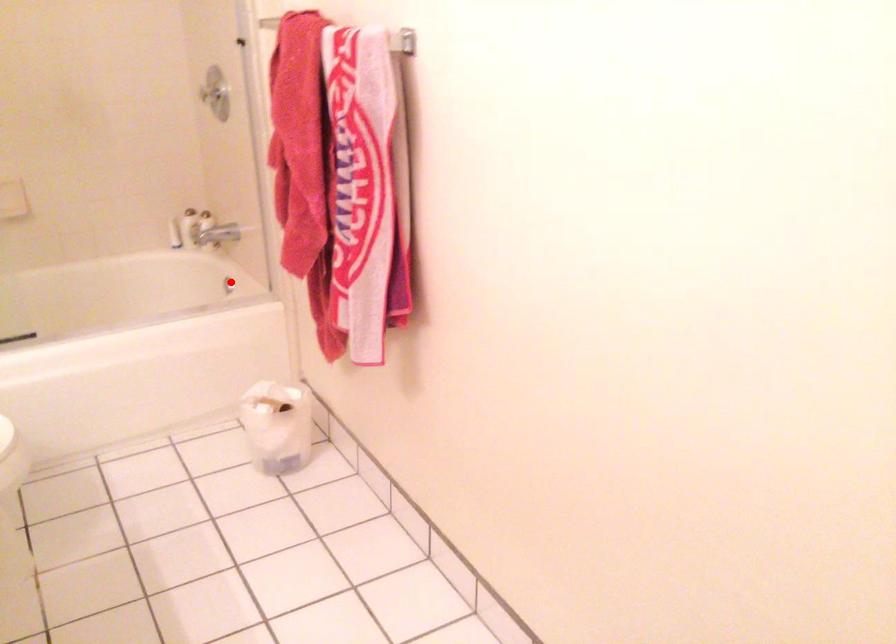
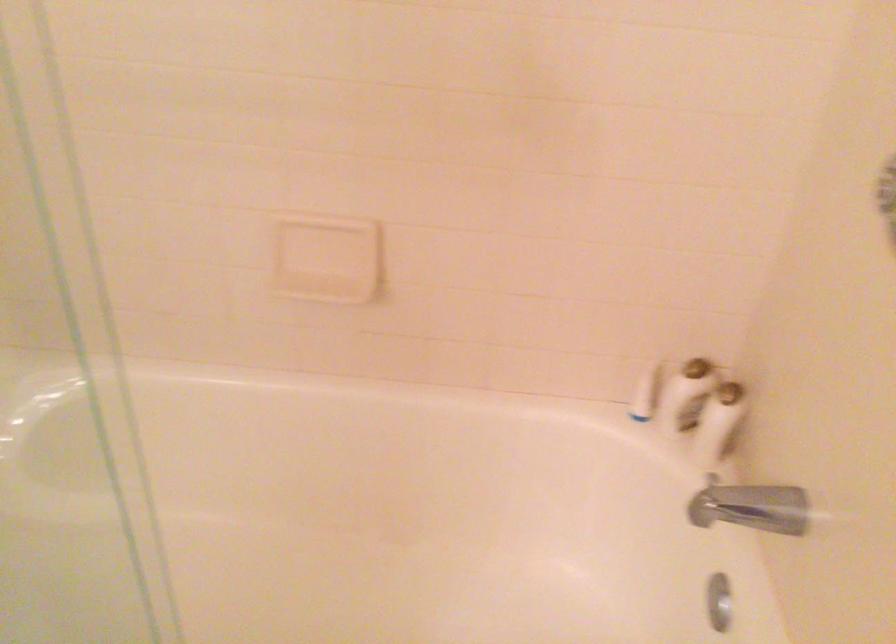
The point at the highlighted location is marked in the first image. Where is the corresponding point in the second image?

(719, 601)